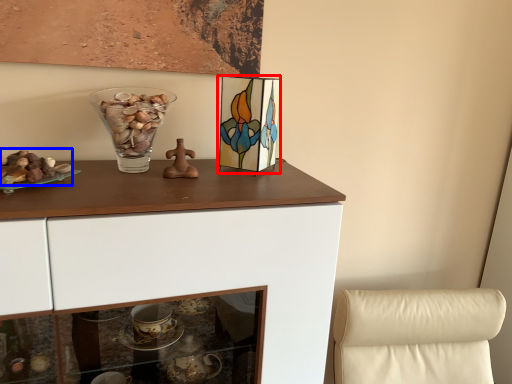
Question: Which object appears farthest to the camera in this image, picture frame (highlighted by a red box) or stuff (highlighted by a blue box)?

Choices:
 (A) picture frame
 (B) stuff

Answer: (A)